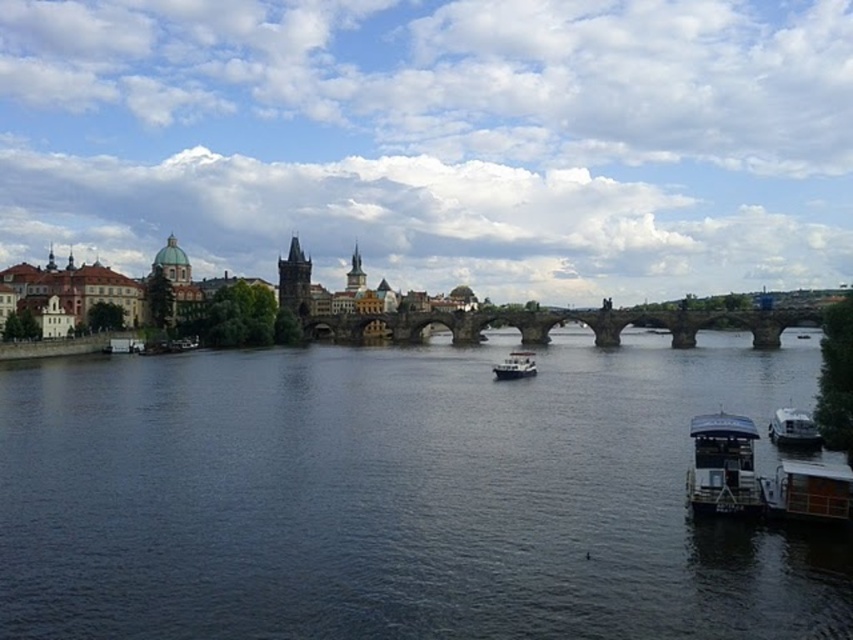
You are standing on the riverside and want to board the closest boat. Which boat should you choose between the white glossy boat at lower right and the white glossy boat at center?

The white glossy boat at lower right is closer to you, so you should choose that one.

You are a photographer planning to capture a wide shot of the riverside scene. You want to include both the metallic gray boat at lower right and the white glossy boat at lower right in your frame. Which boat should you position closer to the center of the image to emphasize its size?

You should position the metallic gray boat at lower right closer to the center of the image to emphasize its size since it is bigger than the white glossy boat at lower right.

Based on the photo, you are standing at the riverside and want to take a photo of the metallic gray boat at lower right. If your camera can focus on objects up to 50 meters away, will it be able to capture a clear image of the boat?

The metallic gray boat at lower right is 54.59 meters from camera, which is beyond the camera maximum focus distance of 50 meters. Therefore, the camera cannot capture a clear image of the boat.